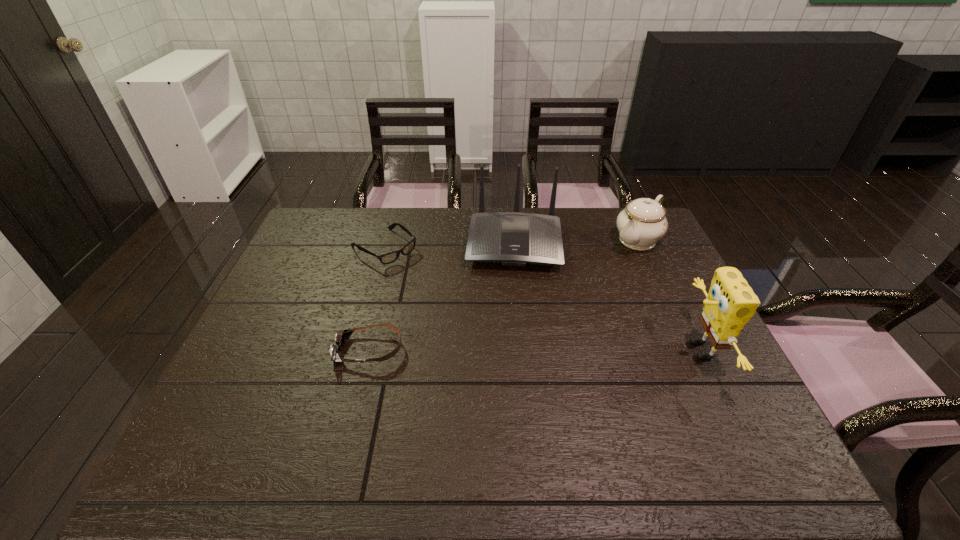
Image resolution: width=960 pixels, height=540 pixels. What are the coordinates of `vacant region at the left edge of the desktop` in the screenshot? It's located at (228, 388).

In the image, there is a desktop. Identify the location of vacant area at the right edge. The image size is (960, 540). (651, 260).

You are a GUI agent. You are given a task and a screenshot of the screen. Output one action in this format:
    pyautogui.click(x=<x>, y=<y>)
    Task: Click on the free space at the far left corner of the desktop
    Image resolution: width=960 pixels, height=540 pixels.
    Given the screenshot: What is the action you would take?
    pyautogui.click(x=297, y=239)

The height and width of the screenshot is (540, 960). I want to click on vacant region between the sponge and the third shortest object, so click(x=668, y=295).

Identify the location of free spot between the spectacles and the sponge. (541, 299).

Where is `empty space between the chinaware and the sponge`? Image resolution: width=960 pixels, height=540 pixels. empty space between the chinaware and the sponge is located at coordinates (668, 295).

Identify the location of free space between the router and the spectacles. (x=449, y=246).

The height and width of the screenshot is (540, 960). Identify the location of free space between the sponge and the spectacles. (541, 299).

Locate an element on the screen. This screenshot has height=540, width=960. free point between the third tallest object and the router is located at coordinates (576, 241).

Image resolution: width=960 pixels, height=540 pixels. In order to click on unoccupied position between the spectacles and the sponge in this screenshot , I will do `click(541, 299)`.